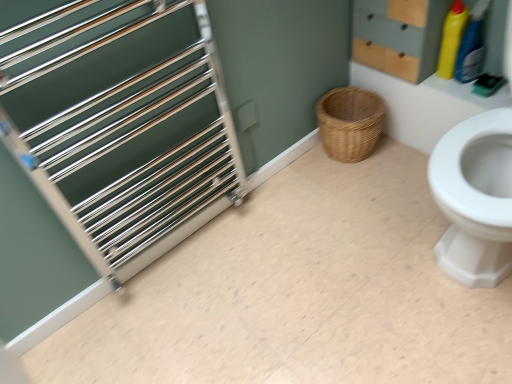
Question: Is wooden drawer at upper right at the back of woven natural basket at lower center?

Choices:
 (A) yes
 (B) no

Answer: (B)

Question: Is woven natural basket at lower center touching wooden drawer at upper right?

Choices:
 (A) yes
 (B) no

Answer: (B)

Question: Considering the relative positions of woven natural basket at lower center and wooden drawer at upper right in the image provided, is woven natural basket at lower center to the left of wooden drawer at upper right from the viewer's perspective?

Choices:
 (A) yes
 (B) no

Answer: (A)

Question: From a real-world perspective, is woven natural basket at lower center beneath wooden drawer at upper right?

Choices:
 (A) yes
 (B) no

Answer: (A)

Question: Does woven natural basket at lower center have a lesser width compared to wooden drawer at upper right?

Choices:
 (A) yes
 (B) no

Answer: (B)

Question: Can you confirm if woven natural basket at lower center is smaller than wooden drawer at upper right?

Choices:
 (A) no
 (B) yes

Answer: (B)

Question: Is brushed metal towel rack at left to the right of polished metal rack at left from the viewer's perspective?

Choices:
 (A) no
 (B) yes

Answer: (B)

Question: Does brushed metal towel rack at left have a lesser width compared to polished metal rack at left?

Choices:
 (A) yes
 (B) no

Answer: (B)

Question: Can you confirm if brushed metal towel rack at left is taller than polished metal rack at left?

Choices:
 (A) yes
 (B) no

Answer: (B)

Question: From a real-world perspective, is brushed metal towel rack at left positioned under polished metal rack at left based on gravity?

Choices:
 (A) yes
 (B) no

Answer: (A)

Question: Would you say brushed metal towel rack at left contains polished metal rack at left?

Choices:
 (A) yes
 (B) no

Answer: (B)

Question: From a real-world perspective, is brushed metal towel rack at left on top of polished metal rack at left?

Choices:
 (A) yes
 (B) no

Answer: (B)

Question: Does yellow plastic bottle at upper right, placed as the second cleaning product when sorted from right to left, have a lesser width compared to brushed metal towel rack at left?

Choices:
 (A) yes
 (B) no

Answer: (A)